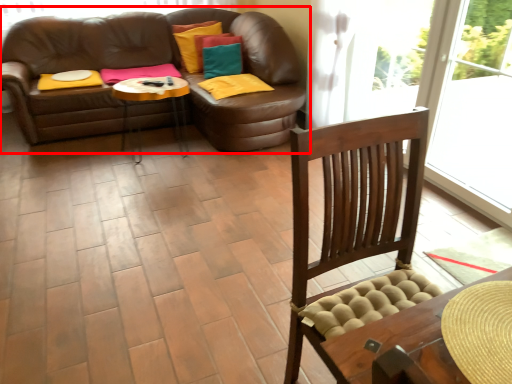
Question: Observing the image, what is the correct spatial positioning of studio couch (annotated by the red box) in reference to footrest?

Choices:
 (A) right
 (B) left

Answer: (B)